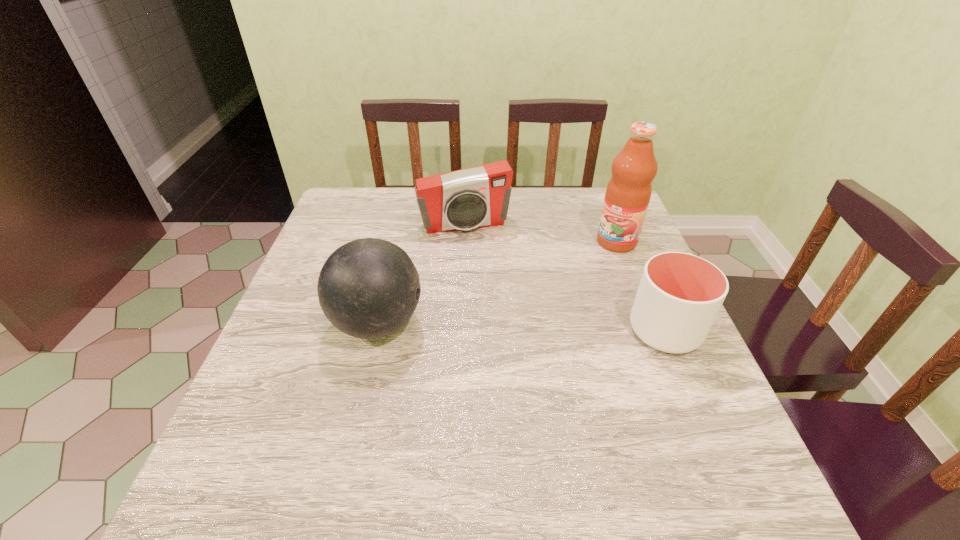
What are the coordinates of `bowling ball` in the screenshot? It's located at (369, 288).

Find the location of a particular element. The width and height of the screenshot is (960, 540). cup is located at coordinates (679, 296).

Locate an element on the screen. This screenshot has width=960, height=540. fruit juice is located at coordinates (628, 193).

Where is `camera`? camera is located at coordinates (475, 197).

Identify the location of vacant area situated on the grip area of the bowling ball. (563, 323).

Identify the location of vacant region located 0.310m on the left of the cup. This screenshot has height=540, width=960. (489, 330).

Identify the location of vacant point located on the front label of the tallest object. Image resolution: width=960 pixels, height=540 pixels. (587, 263).

In order to click on free space located on the front label of the tallest object in this screenshot , I will do `click(525, 307)`.

The width and height of the screenshot is (960, 540). Find the location of `vacant space located on the front label of the tallest object`. vacant space located on the front label of the tallest object is located at coordinates (570, 275).

At what (x,y) coordinates should I click in order to perform the action: click on free location located on the front-facing side of the camera. Please return your answer as a coordinate pair (x, y). This screenshot has width=960, height=540. Looking at the image, I should click on (497, 308).